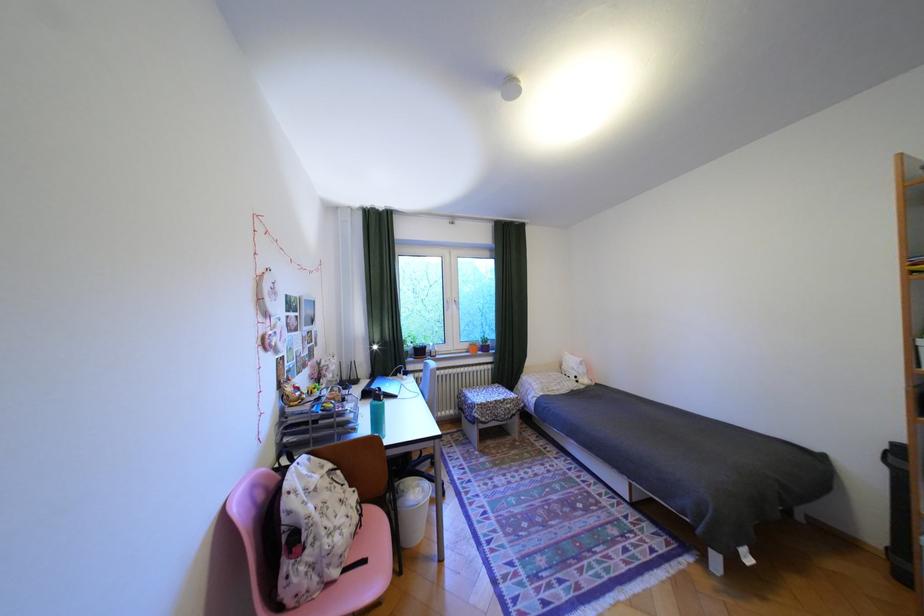
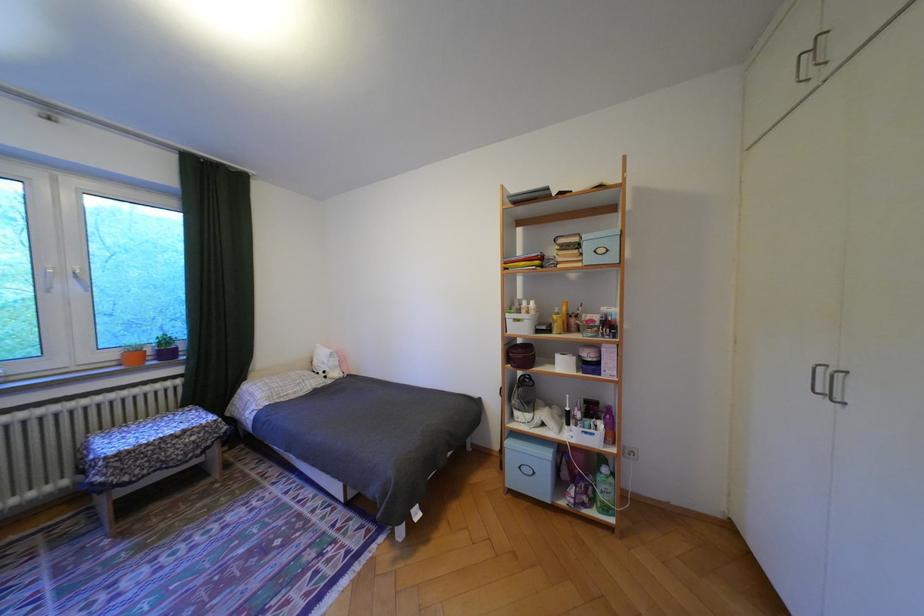
Where in the second image is the point corresponding to the point at 496,349 from the first image?

(178, 354)